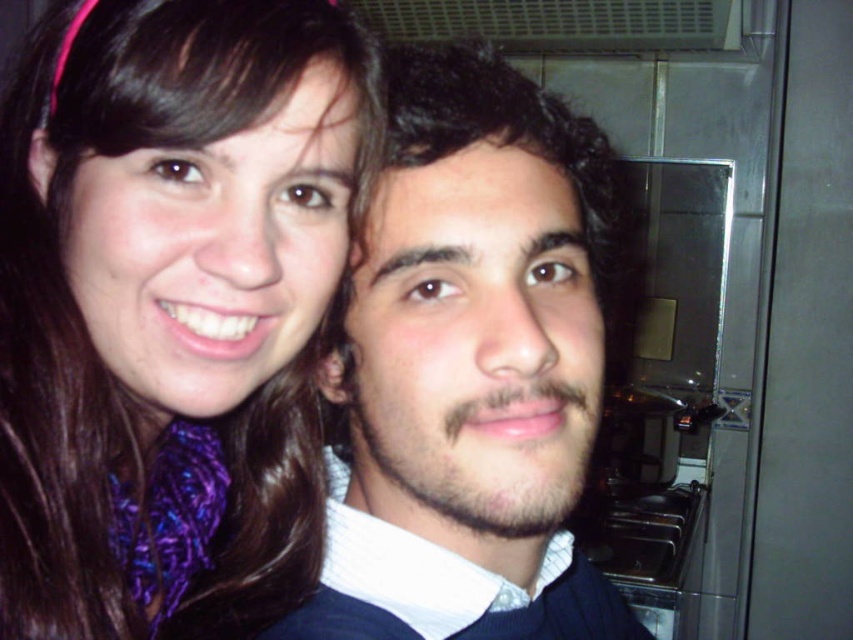
Question: Is purple silky scarf at upper left in front of dark brown curly hair at center?

Choices:
 (A) yes
 (B) no

Answer: (A)

Question: Is purple silky scarf at upper left to the left of dark brown curly hair at center from the viewer's perspective?

Choices:
 (A) yes
 (B) no

Answer: (A)

Question: Is purple silky scarf at upper left thinner than dark brown curly hair at center?

Choices:
 (A) no
 (B) yes

Answer: (B)

Question: Which point appears farthest from the camera in this image?

Choices:
 (A) (28, 563)
 (B) (581, 177)

Answer: (B)

Question: Which point is farther to the camera?

Choices:
 (A) (260, 134)
 (B) (450, 163)

Answer: (B)